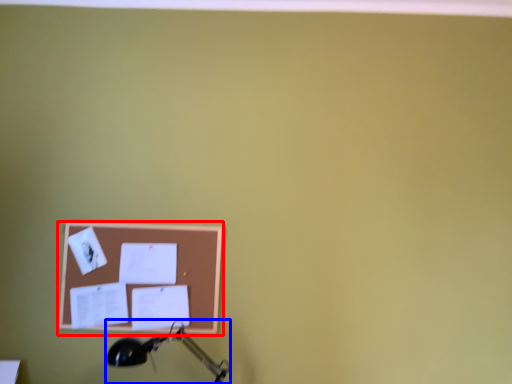
Question: Which object is closer to the camera taking this photo, picture frame (highlighted by a red box) or table lamp (highlighted by a blue box)?

Choices:
 (A) picture frame
 (B) table lamp

Answer: (B)